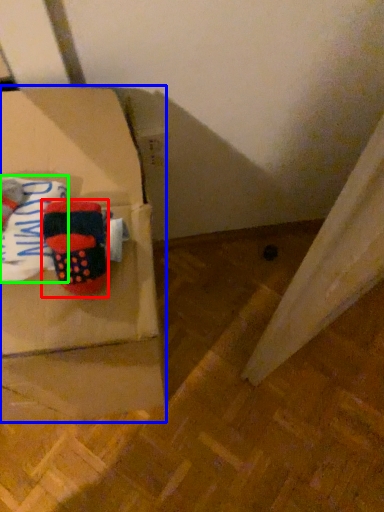
Question: Considering the real-world distances, which object is farthest from footwear (highlighted by a red box)? box (highlighted by a blue box) or clothing (highlighted by a green box)?

Choices:
 (A) box
 (B) clothing

Answer: (A)